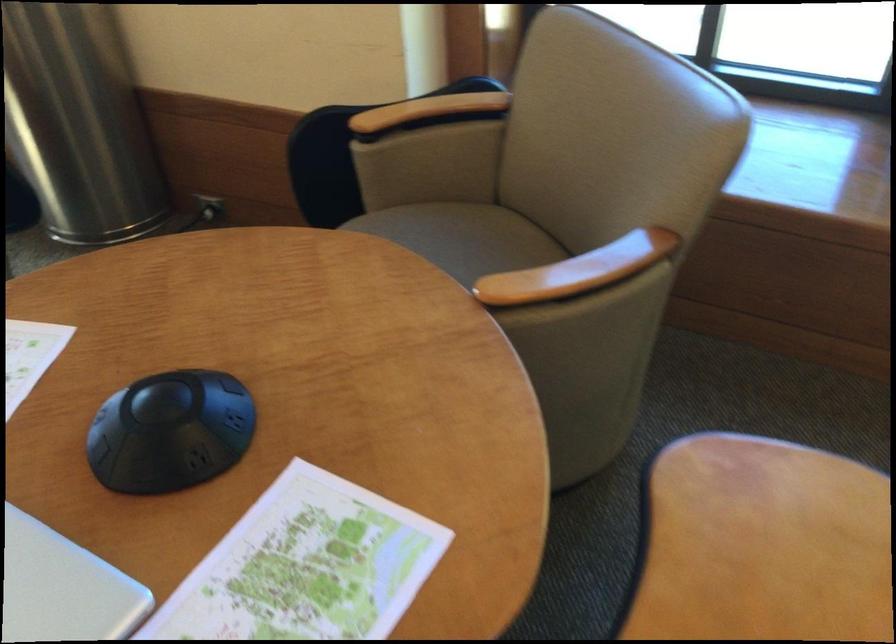
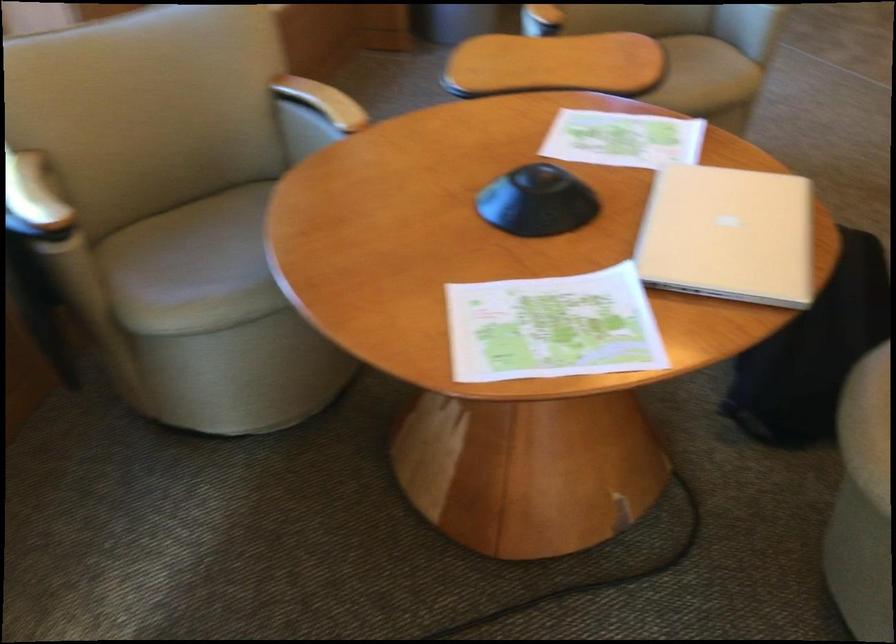
Find the pixel in the second image that matches (x=460, y=147) in the first image.

(33, 200)